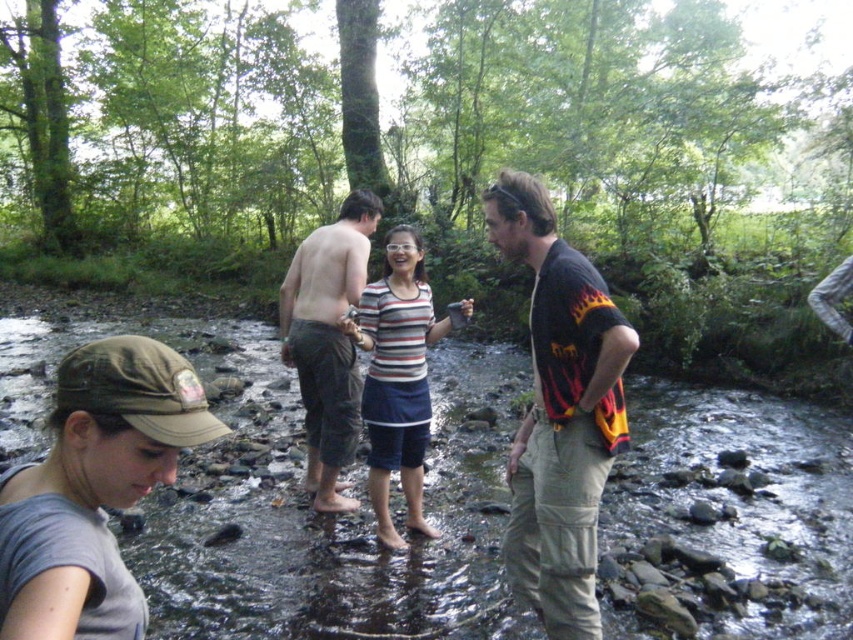
Question: Considering the real-world distances, which object is farthest from the clear water at creek center?

Choices:
 (A) black cotton shirt at center
 (B) gray matte cap at lower left
 (C) green cotton shorts at center

Answer: (B)

Question: Is gray matte cap at lower left to the left of black cotton shirt at center from the viewer's perspective?

Choices:
 (A) no
 (B) yes

Answer: (B)

Question: Which object appears farthest from the camera in this image?

Choices:
 (A) gray matte cap at lower left
 (B) clear water at creek center
 (C) striped fabric shirt at center

Answer: (C)

Question: Where is black cotton shirt at center located in relation to striped fabric shirt at center in the image?

Choices:
 (A) below
 (B) above

Answer: (B)

Question: Can you confirm if clear water at creek center is positioned to the right of striped fabric shirt at center?

Choices:
 (A) yes
 (B) no

Answer: (B)

Question: Which object is farther from the camera taking this photo?

Choices:
 (A) clear water at creek center
 (B) green cotton shorts at center
 (C) striped fabric shirt at center

Answer: (B)